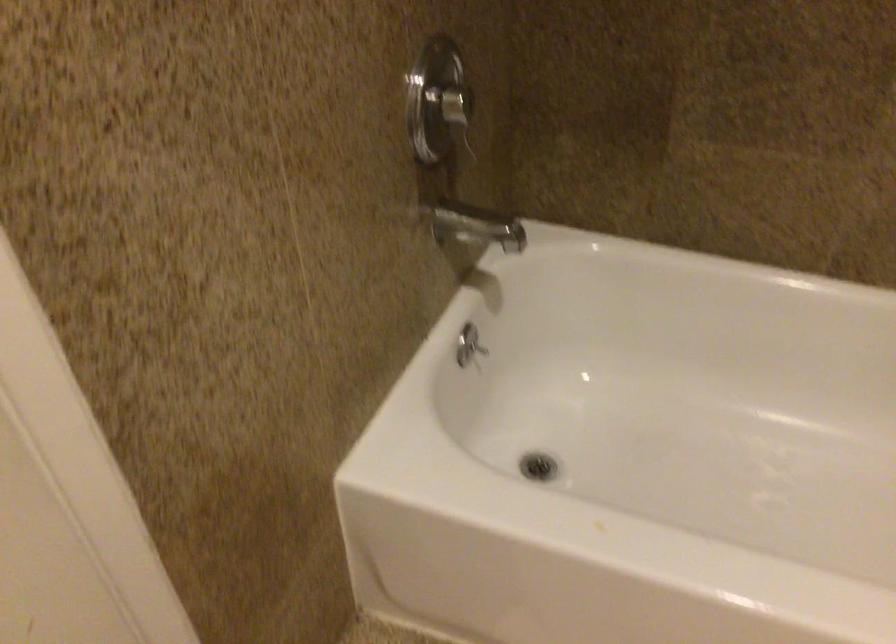
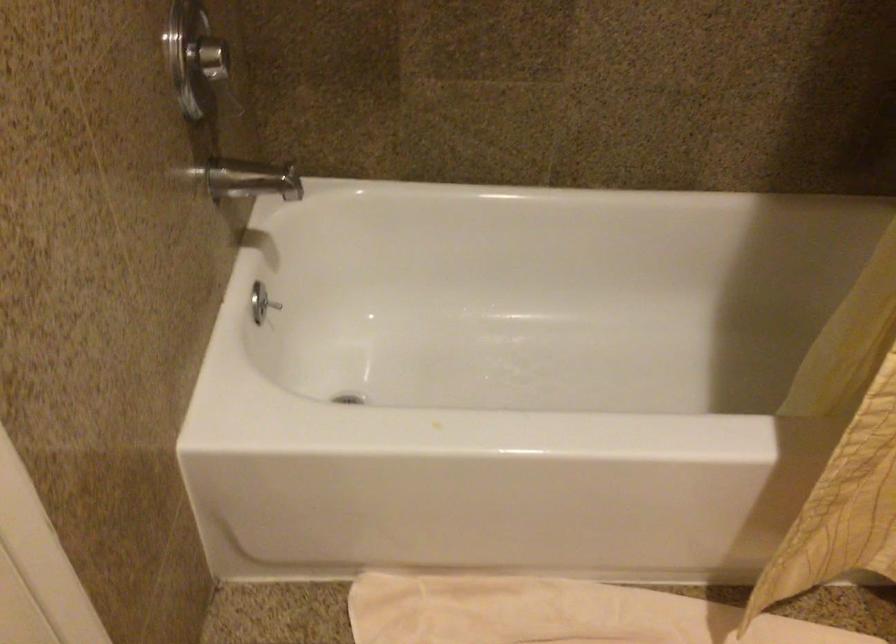
Question: The camera is either moving clockwise (left) or counter-clockwise (right) around the object. The first image is from the beginning of the video and the second image is from the end. Is the camera moving left or right when shooting the video?

Choices:
 (A) Left
 (B) Right

Answer: (A)